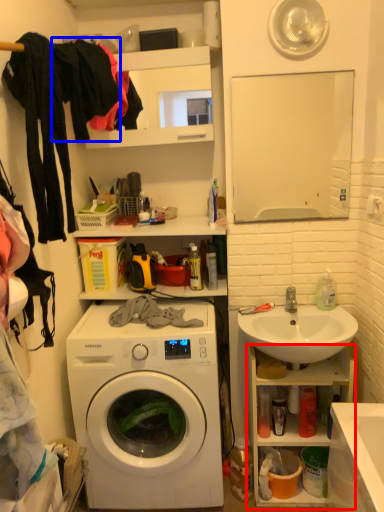
Question: Among these objects, which one is farthest to the camera, cabinet (highlighted by a red box) or clothing (highlighted by a blue box)?

Choices:
 (A) cabinet
 (B) clothing

Answer: (A)